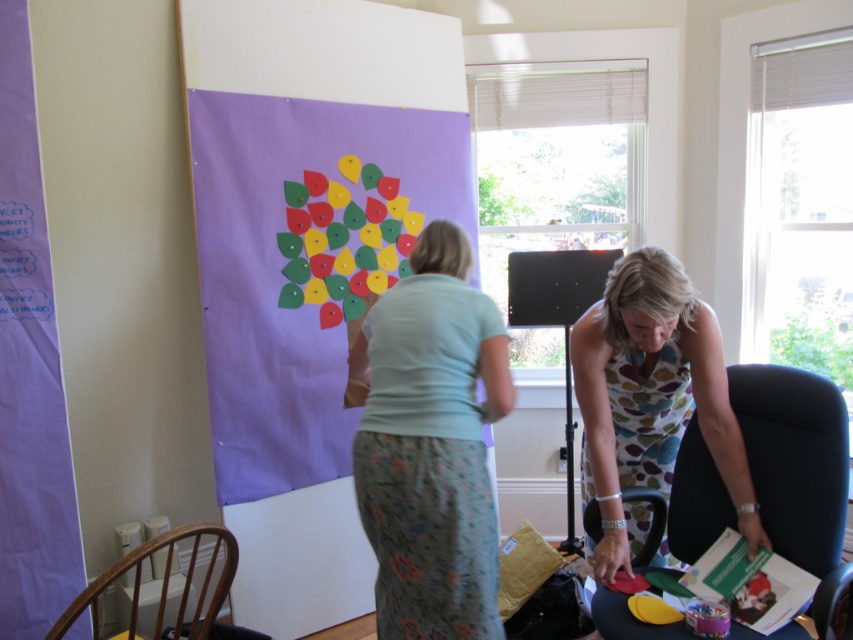
You are standing in the room and want to place a new decorative item on the floor. The floral dress at lower right is currently occupying a spot. Can you place the new item near the wall without moving the dress?

The floral dress at lower right is located at point (651, 400), so placing the new item near the wall should be possible as long as it doesn t interfere with the dress s position.

You are standing in the room and want to take a closer look at the matte paper poster at center. If you walk 5 feet forward from your current position, will you be able to touch it?

The matte paper poster at center is 7.88 feet away from the camera. If you walk 5 feet forward, you will still be 2.88 feet away from it, so you won not be able to touch it.

You are an artist standing at the edge of the room, and you want to place a new paper cutout on the matte paper poster at center from your current position. The cutout is 1.5 meters long. Can you reach the poster without moving the matte plastic table at lower center?

The distance between the matte paper poster at center and the matte plastic table at lower center is 1.40 meters. Since your cutout is 1.5 meters long, you can extend it to reach the poster without needing to move the table.